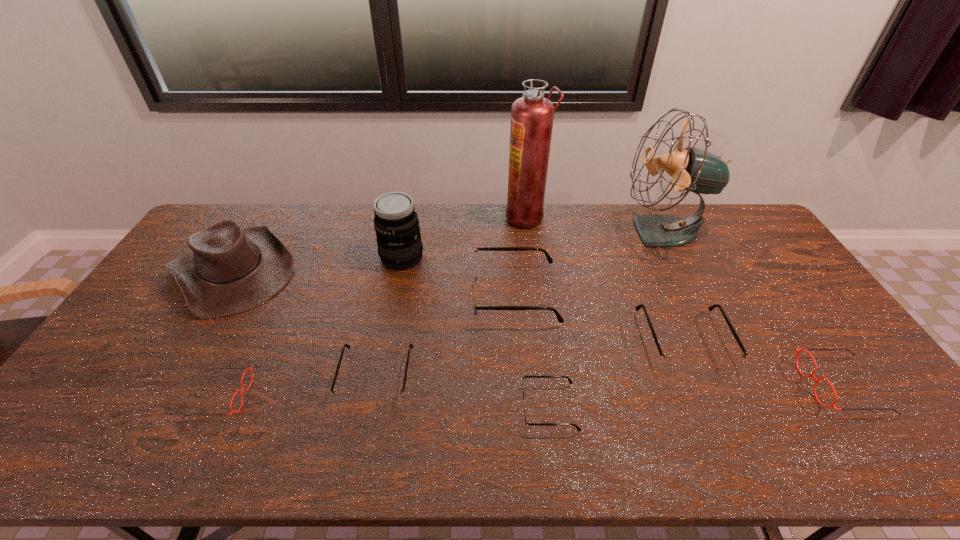
The height and width of the screenshot is (540, 960). I want to click on fire extinguisher, so click(x=532, y=115).

Where is `blue fan`? blue fan is located at coordinates (696, 170).

Identify the location of the third tallest object. Image resolution: width=960 pixels, height=540 pixels. (396, 223).

You are a GUI agent. You are given a task and a screenshot of the screen. Output one action in this format:
    pyautogui.click(x=<x>, y=<y>)
    Task: Click on the seventh shortest object
    
    Given the screenshot: What is the action you would take?
    pyautogui.click(x=227, y=269)

What are the coordinates of `the sixth shortest object` in the screenshot? It's located at (474, 266).

You are a GUI agent. You are given a task and a screenshot of the screen. Output one action in this format:
    pyautogui.click(x=<x>, y=<y>)
    Task: Click on the tallest spectacles
    This screenshot has width=960, height=540.
    Given the screenshot: What is the action you would take?
    pyautogui.click(x=474, y=266)

At what (x,y) coordinates should I click in order to perform the action: click on the rightmost black spectacles. Please return your answer as a coordinate pair (x, y). The height and width of the screenshot is (540, 960). Looking at the image, I should click on (673, 362).

Locate an element on the screen. the second biggest black spectacles is located at coordinates pyautogui.click(x=673, y=362).

At what (x,y) coordinates should I click in order to perform the action: click on the right red spectacles. Please return your answer as a coordinate pair (x, y). Image resolution: width=960 pixels, height=540 pixels. Looking at the image, I should click on (833, 405).

Identify the location of the rightmost spectacles. Image resolution: width=960 pixels, height=540 pixels. (833, 405).